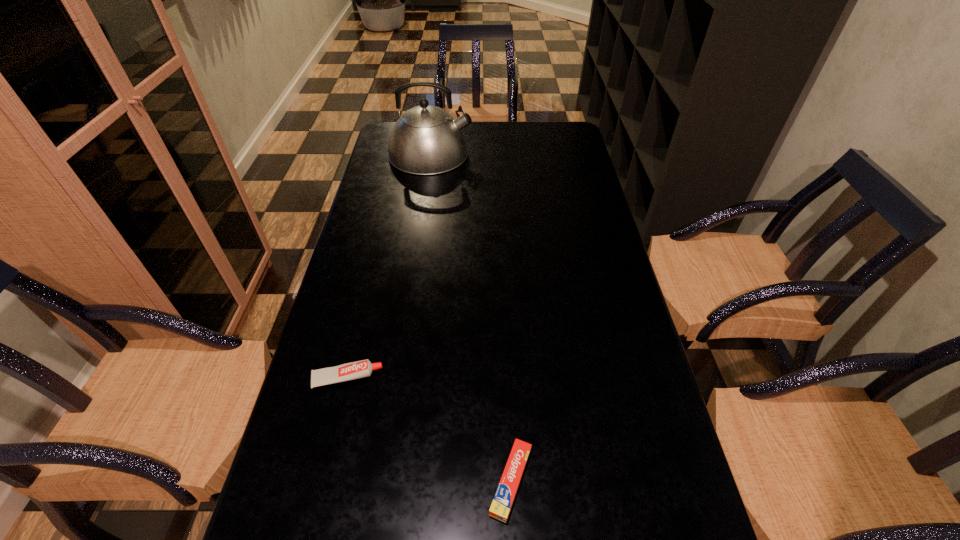
Where is `the tallest object`? The height and width of the screenshot is (540, 960). the tallest object is located at coordinates (426, 140).

Where is `the farthest object`? The image size is (960, 540). the farthest object is located at coordinates (426, 140).

Where is `the second shortest object`? the second shortest object is located at coordinates (359, 369).

Locate an element on the screen. This screenshot has width=960, height=540. the farther toothpaste is located at coordinates (359, 369).

Locate an element on the screen. The width and height of the screenshot is (960, 540). the shortest object is located at coordinates (501, 505).

Image resolution: width=960 pixels, height=540 pixels. In order to click on the nearer toothpaste in this screenshot , I will do `click(501, 505)`.

At what (x,y) coordinates should I click in order to perform the action: click on free space located 0.160m from the spout of the farthest object. Please return your answer as a coordinate pair (x, y). Looking at the image, I should click on (516, 153).

Where is `free spot located on the right of the farther toothpaste`? The height and width of the screenshot is (540, 960). free spot located on the right of the farther toothpaste is located at coordinates (555, 378).

Where is `free space located on the left of the rightmost object`? The image size is (960, 540). free space located on the left of the rightmost object is located at coordinates (277, 481).

Image resolution: width=960 pixels, height=540 pixels. What are the coordinates of `object that is at the far edge` in the screenshot? It's located at (426, 140).